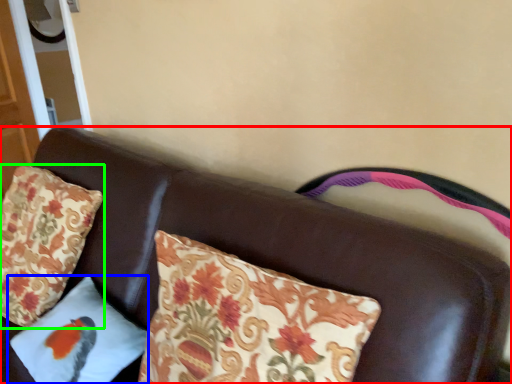
Question: Estimate the real-world distances between objects in this image. Which object is farther from furniture (highlighted by a red box), pillow (highlighted by a blue box) or pillow (highlighted by a green box)?

Choices:
 (A) pillow
 (B) pillow

Answer: (B)